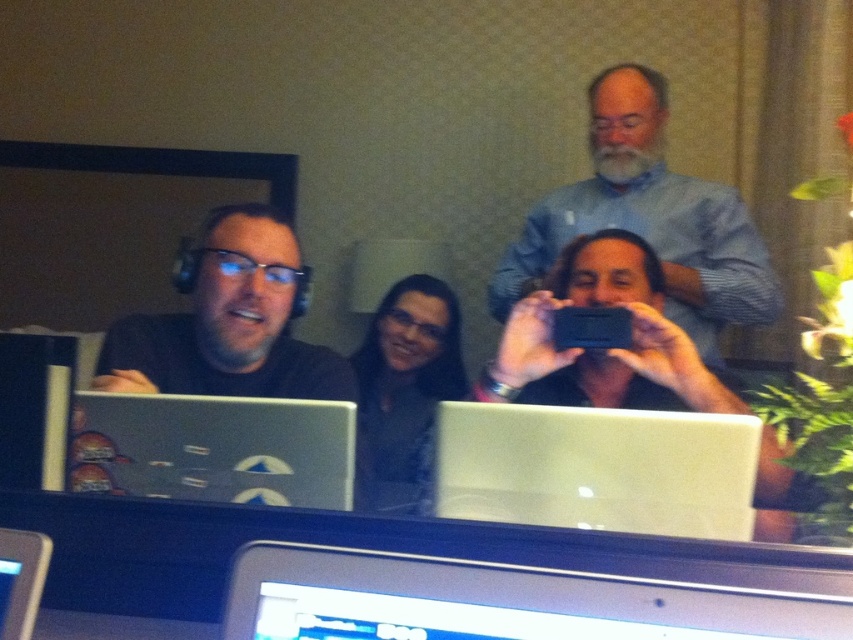
You are setting up a presentation and need to place your materials. Given the silver metallic monitor at lower center and the matte black phone at center, which object is positioned lower in the scene?

The silver metallic monitor at lower center is positioned lower than the matte black phone at center.

You are sitting at a table in the conference room and want to place a new laptop between the two existing points marked as point (584, 577) and point (679, 396). Based on their positions, which point should the new laptop be closer to?

The new laptop should be closer to point (679, 396) because point (584, 577) is in front of point (679, 396), meaning it is farther away from the observer.

You are organizing a tech showcase and need to place the silver metallic laptop at lower left and the matte black phone at center on a display table. According to the scene, which object should be placed to the left side of the display table?

The silver metallic laptop at lower left should be placed to the left side of the display table since it is positioned to the left of the matte black phone at center in the original scene.